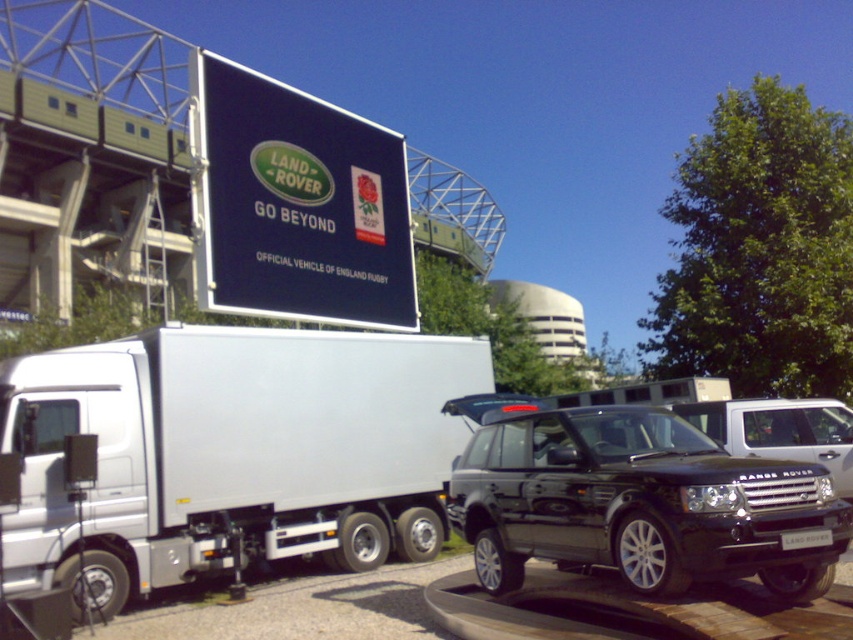
Is white metallic trailer truck at left below black metallic car at center?

Yes, white metallic trailer truck at left is below black metallic car at center.

Between white metallic trailer truck at left and black metallic car at center, which one appears on the left side from the viewer's perspective?

From the viewer's perspective, white metallic trailer truck at left appears more on the left side.

Who is more forward, (376, 337) or (761, 433)?

Point (761, 433) is in front.

At what (x,y) coordinates should I click in order to perform the action: click on white metallic trailer truck at left. Please return your answer as a coordinate pair (x, y). Looking at the image, I should click on (231, 452).

Based on the photo, is the position of black metallic car at center less distant than that of black metallic license plate at center?

No.

Is point (831, 426) positioned before point (809, 540)?

No, it is behind (809, 540).

Which is in front, point (848, 424) or point (827, 529)?

Point (827, 529)

Where is `black metallic car at center`? This screenshot has height=640, width=853. black metallic car at center is located at coordinates (780, 429).

Between white metallic trailer truck at left and black metallic suv at center, which one is positioned higher?

Positioned higher is black metallic suv at center.

In order to click on white metallic trailer truck at left in this screenshot , I will do `click(231, 452)`.